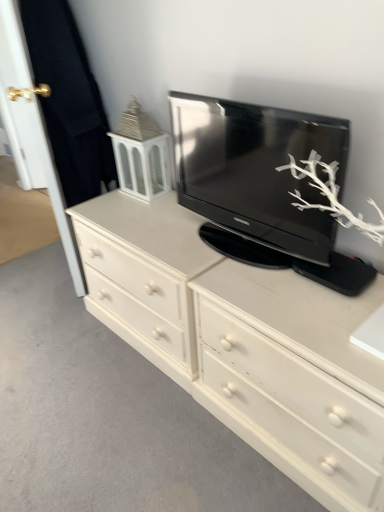
Image resolution: width=384 pixels, height=512 pixels. In order to click on vacant region below white painted wood tv cabinet at upper left (from a real-world perspective) in this screenshot , I will do `click(140, 195)`.